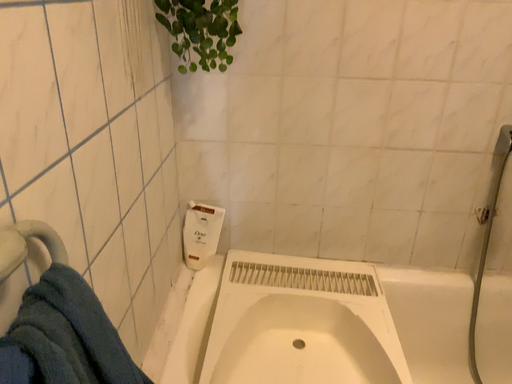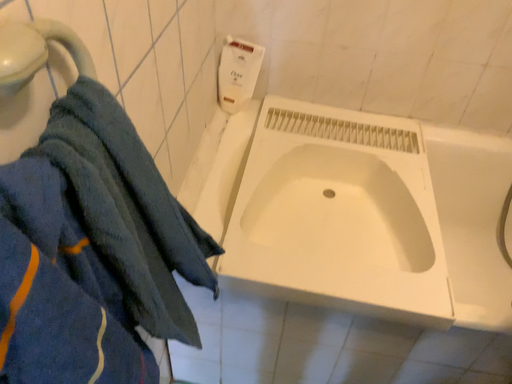
Question: How did the camera likely rotate when shooting the video?

Choices:
 (A) rotated upward
 (B) rotated downward

Answer: (B)